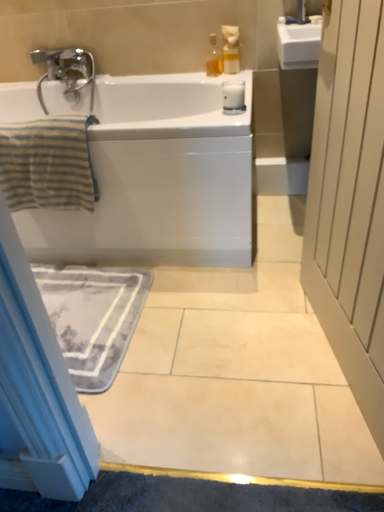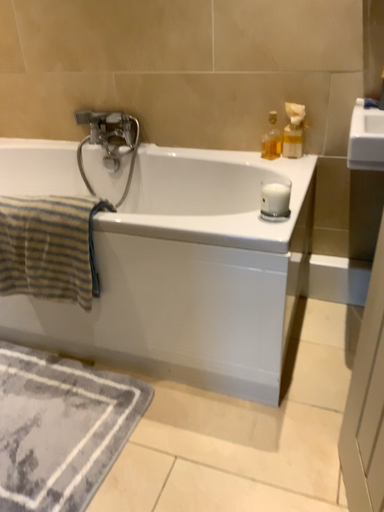
Question: Which way did the camera rotate in the video?

Choices:
 (A) rotated left
 (B) rotated right

Answer: (A)